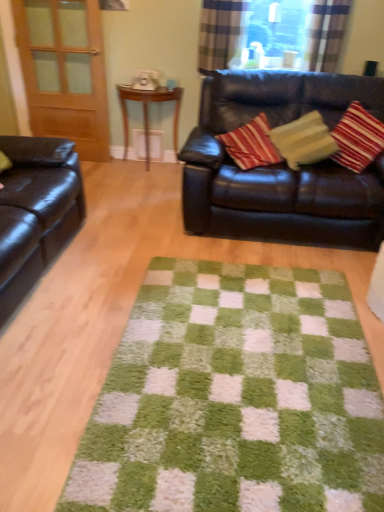
The width and height of the screenshot is (384, 512). Find the location of `free space above green shaggy rug at center (from a real-world perspective)`. free space above green shaggy rug at center (from a real-world perspective) is located at coordinates (248, 366).